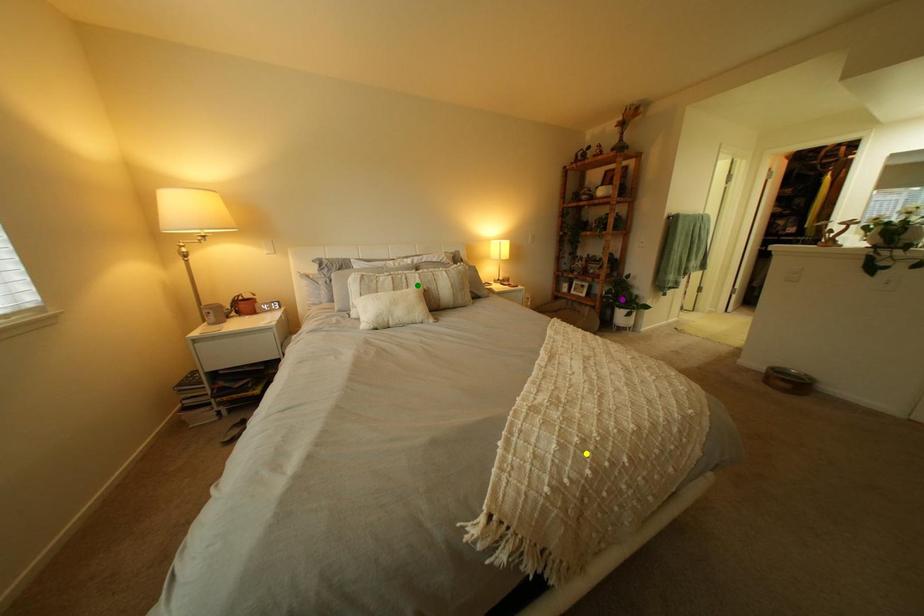
Order these from nearest to farthest:
1. green point
2. purple point
3. yellow point

yellow point, green point, purple point